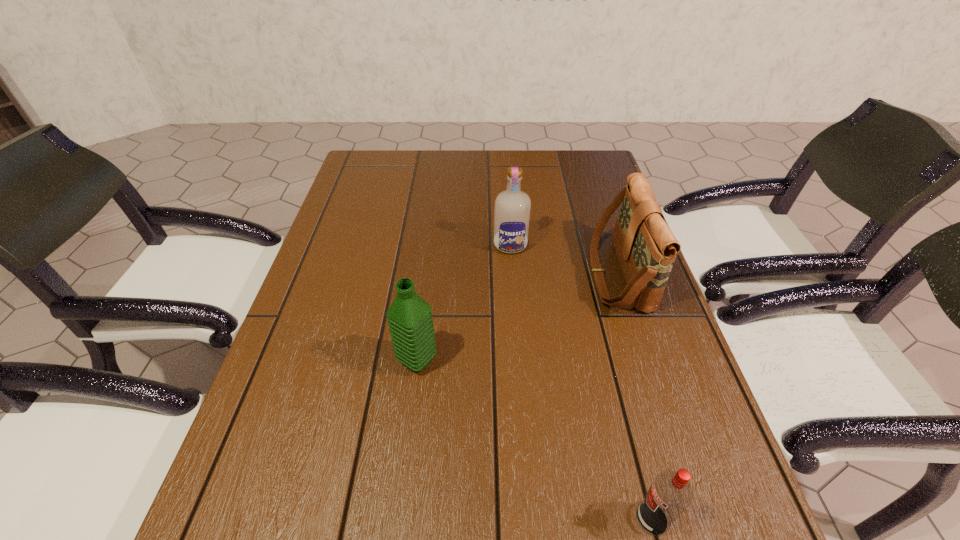
You are a GUI agent. You are given a task and a screenshot of the screen. Output one action in this format:
    pyautogui.click(x=<x>, y=<y>)
    Task: Click on the free spot located on the front-facing side of the shoulder bag
    This screenshot has width=960, height=540.
    Given the screenshot: What is the action you would take?
    click(460, 274)

At what (x,y) coordinates should I click in order to perform the action: click on vacant position located 0.230m on the front-facing side of the shoulder bag. Please return your answer as a coordinate pair (x, y). This screenshot has width=960, height=540. Looking at the image, I should click on (499, 274).

The image size is (960, 540). Find the location of `free space located 0.160m on the front label of the shortest object`. free space located 0.160m on the front label of the shortest object is located at coordinates (535, 518).

Where is `blank space located on the front label of the shortest object`? This screenshot has height=540, width=960. blank space located on the front label of the shortest object is located at coordinates (396, 518).

This screenshot has height=540, width=960. In order to click on free spot located on the front label of the shortest object in this screenshot , I will do click(x=466, y=518).

Image resolution: width=960 pixels, height=540 pixels. In order to click on object situated at the near edge in this screenshot , I will do `click(670, 494)`.

Locate an element on the screen. This screenshot has width=960, height=540. shoulder bag that is at the right edge is located at coordinates (646, 248).

The width and height of the screenshot is (960, 540). In order to click on vodka that is positioned at the right edge in this screenshot , I will do `click(670, 494)`.

Locate an element on the screen. This screenshot has height=540, width=960. object located at the near right corner is located at coordinates (670, 494).

In the image, there is a desktop. Where is `vacant space at the far edge`? This screenshot has height=540, width=960. vacant space at the far edge is located at coordinates (508, 159).